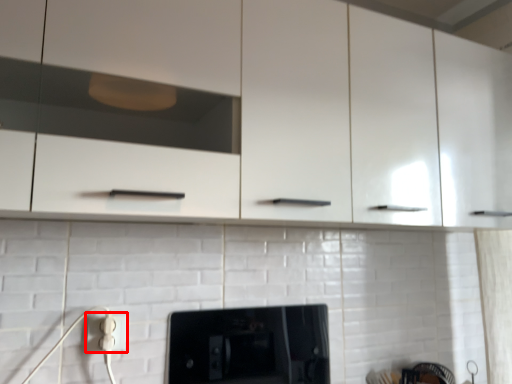
Question: Where is electric outlet (annotated by the red box) located in relation to home appliance in the image?

Choices:
 (A) right
 (B) left

Answer: (B)